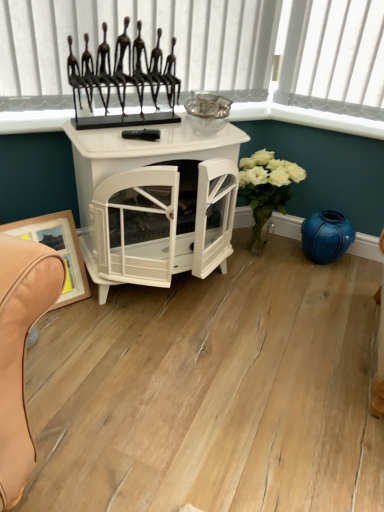
Question: Considering the positions of metallic black stand at upper center and wooden framed picture at lower left in the image, is metallic black stand at upper center taller or shorter than wooden framed picture at lower left?

Choices:
 (A) short
 (B) tall

Answer: (A)

Question: Visually, is metallic black stand at upper center positioned to the left or to the right of wooden framed picture at lower left?

Choices:
 (A) left
 (B) right

Answer: (B)

Question: Which is nearer to the wooden framed picture at lower left?

Choices:
 (A) white glossy fireplace at center
 (B) blue glossy vase at lower right
 (C) metallic black sculpture at upper center
 (D) metallic black stand at upper center

Answer: (A)

Question: Based on their relative distances, which object is nearer to the metallic black stand at upper center?

Choices:
 (A) blue glossy vase at lower right
 (B) metallic black sculpture at upper center
 (C) wooden framed picture at lower left
 (D) white glossy fireplace at center

Answer: (B)